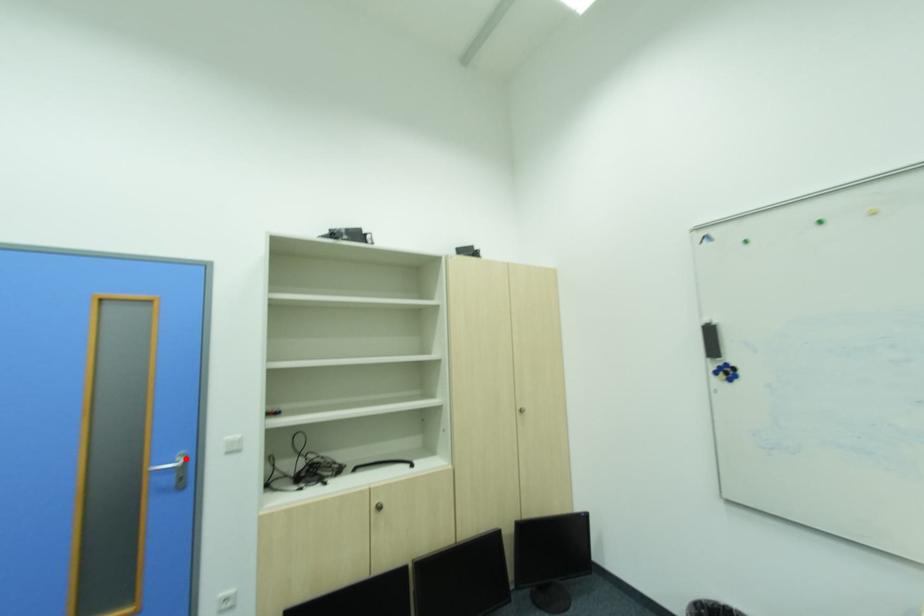
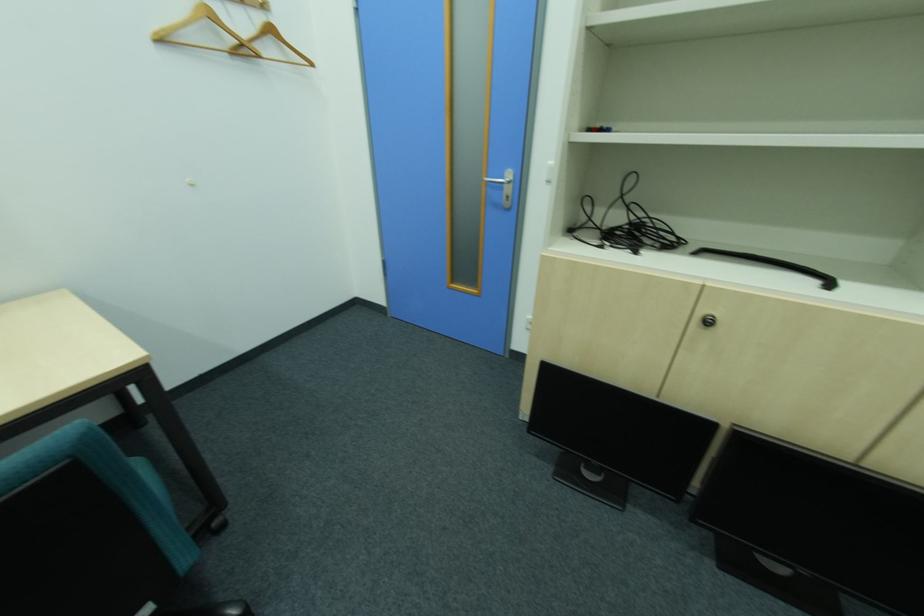
Locate, in the second image, the point that corresponds to the highlighted location in the first image.

(513, 177)